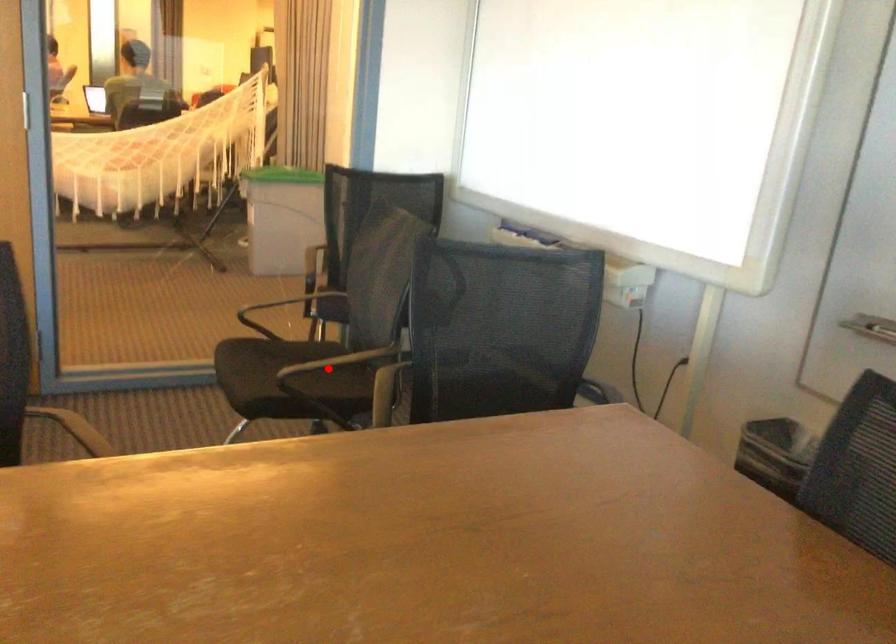
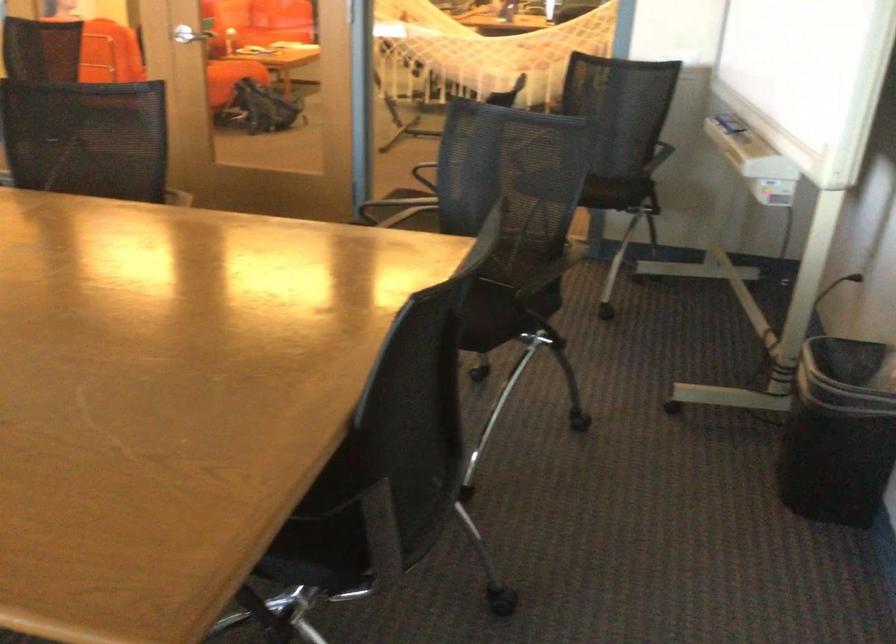
Question: I am providing you with two images of the same scene from different viewpoints. A red point is marked on the first image. Is the red point's position out of view in image 2?

Choices:
 (A) Yes
 (B) No

Answer: (A)